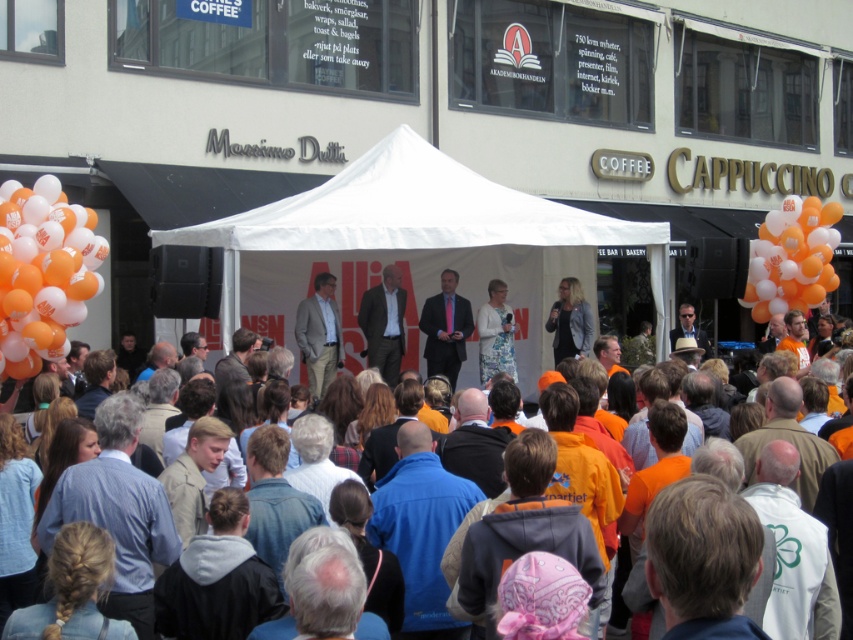
You are organizing an outdoor event and need to decide whether the gray fabric jacket at center can be placed under the white fabric tent at center. Based on their sizes, will the jacket fit under the tent?

The white fabric tent at center is wider than the gray fabric jacket at center, so the jacket will fit under the tent.

You are standing in the crowd at the outdoor event. You want to see the stage better. The white fabric tent at center and the gray fabric jacket at center are blocking your view. Which one should you move around to get a better view?

You should move around the white fabric tent at center because it is in front of the gray fabric jacket at center, meaning it is closer to you and blocking your view more directly.

You are at the outdoor event and want to find the gray fabric jacket at center. Since the orange fabric crowd at center is blocking your view, can you see the jacket through the crowd?

The orange fabric crowd at center has a larger size compared to the gray fabric jacket at center, so the crowd is bigger and might block the view of the jacket.